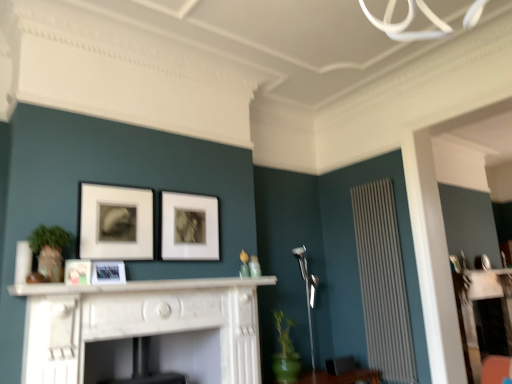
Question: Is matte white picture frame at upper left, which is counted as the third picture frame, starting from the left, not near matte black picture frame at center, arranged as the 4th picture frame when viewed from the left?

Choices:
 (A) no
 (B) yes

Answer: (A)

Question: Is matte white picture frame at upper left, which is counted as the third picture frame, starting from the left, looking in the opposite direction of matte black picture frame at center, positioned as the 1th picture frame in right-to-left order?

Choices:
 (A) no
 (B) yes

Answer: (A)

Question: Does matte white picture frame at upper left, which is counted as the third picture frame, starting from the left, appear on the left side of matte black picture frame at center, arranged as the 4th picture frame when viewed from the left?

Choices:
 (A) no
 (B) yes

Answer: (B)

Question: Does matte white picture frame at upper left, positioned as the second picture frame in right-to-left order, have a smaller size compared to matte black picture frame at center, positioned as the 1th picture frame in right-to-left order?

Choices:
 (A) no
 (B) yes

Answer: (B)

Question: Are matte white picture frame at upper left, positioned as the second picture frame in right-to-left order, and matte black picture frame at center, positioned as the 1th picture frame in right-to-left order, beside each other?

Choices:
 (A) no
 (B) yes

Answer: (A)

Question: Does matte white picture frame at upper left, positioned as the second picture frame in right-to-left order, have a lesser width compared to matte black picture frame at center, positioned as the 1th picture frame in right-to-left order?

Choices:
 (A) yes
 (B) no

Answer: (A)

Question: Can you confirm if matte black picture frame at center, positioned as the 1th picture frame in right-to-left order, is thinner than matte white picture frame at center, the third picture frame in the right-to-left sequence?

Choices:
 (A) yes
 (B) no

Answer: (A)

Question: Does matte black picture frame at center, arranged as the 4th picture frame when viewed from the left, appear on the right side of matte white picture frame at center, the third picture frame in the right-to-left sequence?

Choices:
 (A) no
 (B) yes

Answer: (B)

Question: Is matte black picture frame at center, arranged as the 4th picture frame when viewed from the left, to the left of matte white picture frame at center, placed as the second picture frame when sorted from left to right, from the viewer's perspective?

Choices:
 (A) yes
 (B) no

Answer: (B)

Question: Can you confirm if matte black picture frame at center, arranged as the 4th picture frame when viewed from the left, is bigger than matte white picture frame at center, placed as the second picture frame when sorted from left to right?

Choices:
 (A) yes
 (B) no

Answer: (A)

Question: Is matte black picture frame at center, positioned as the 1th picture frame in right-to-left order, directly adjacent to matte white picture frame at center, the third picture frame in the right-to-left sequence?

Choices:
 (A) no
 (B) yes

Answer: (A)

Question: Can you confirm if matte black picture frame at center, positioned as the 1th picture frame in right-to-left order, is shorter than matte white picture frame at center, placed as the second picture frame when sorted from left to right?

Choices:
 (A) yes
 (B) no

Answer: (B)

Question: Is white glossy picture frame at center, marked as the fourth picture frame in a right-to-left arrangement, wider than white textured radiator at right?

Choices:
 (A) yes
 (B) no

Answer: (B)